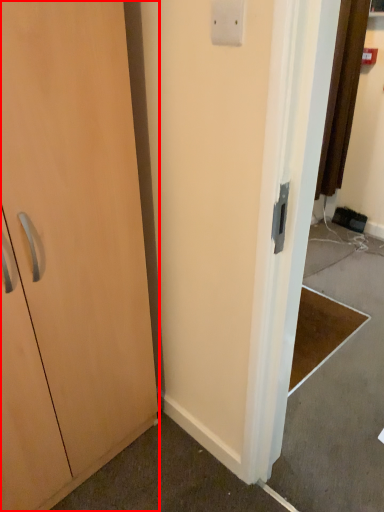
Question: From the image's perspective, considering the relative positions of cabinetry (annotated by the red box) and light switch in the image provided, where is cabinetry (annotated by the red box) located with respect to the staircase?

Choices:
 (A) above
 (B) below

Answer: (B)